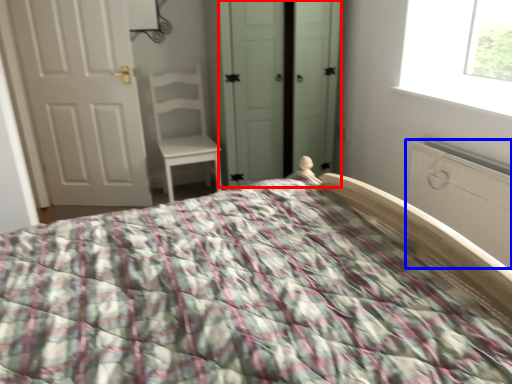
Question: Which object appears closest to the camera in this image, screen door (highlighted by a red box) or armoire (highlighted by a blue box)?

Choices:
 (A) screen door
 (B) armoire

Answer: (B)